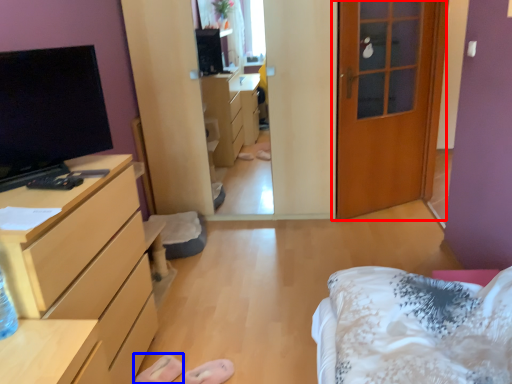
Question: Which object appears closest to the camera in this image, door (highlighted by a red box) or shoe (highlighted by a blue box)?

Choices:
 (A) door
 (B) shoe

Answer: (B)